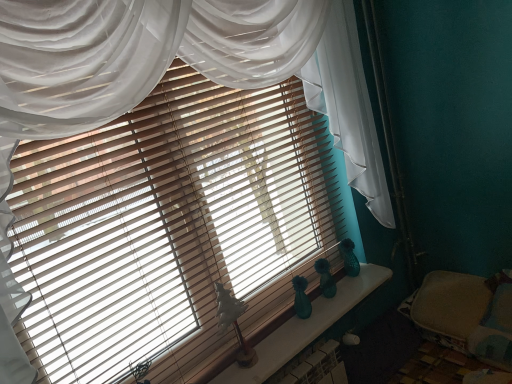
Question: From the image's perspective, is teal glass vases at center above or below beige fabric bed at lower right?

Choices:
 (A) below
 (B) above

Answer: (A)

Question: Would you say teal glass vases at center is to the left or to the right of beige fabric bed at lower right in the picture?

Choices:
 (A) right
 (B) left

Answer: (B)

Question: Is teal glass vases at center bigger or smaller than beige fabric bed at lower right?

Choices:
 (A) big
 (B) small

Answer: (B)

Question: Relative to teal glass vases at center, is beige fabric bed at lower right in front or behind?

Choices:
 (A) behind
 (B) front

Answer: (A)

Question: Based on their positions, is beige fabric bed at lower right located to the left or right of teal glass vases at center?

Choices:
 (A) right
 (B) left

Answer: (A)

Question: From the image's perspective, is beige fabric bed at lower right above or below teal glass vases at center?

Choices:
 (A) below
 (B) above

Answer: (B)

Question: Is beige fabric bed at lower right wider or thinner than teal glass vases at center?

Choices:
 (A) wide
 (B) thin

Answer: (A)